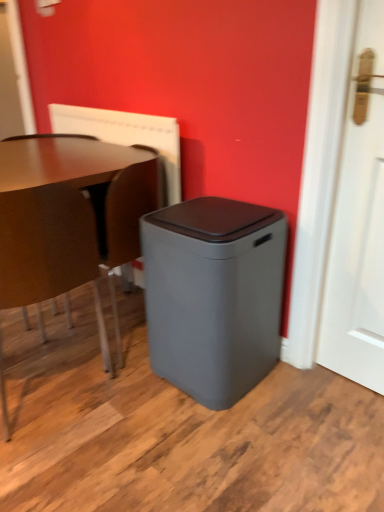
Identify the location of vacant space in front of white matte door at right. click(353, 417).